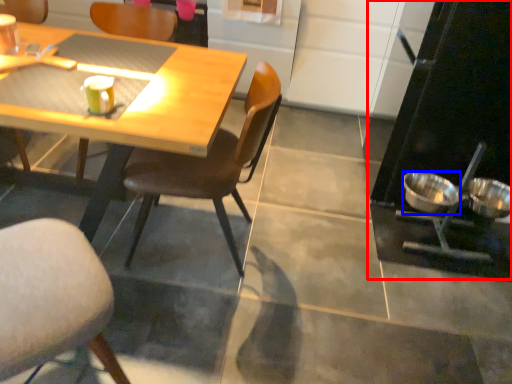
Question: Among these objects, which one is nearest to the camera, appliance (highlighted by a red box) or bowl (highlighted by a blue box)?

Choices:
 (A) appliance
 (B) bowl

Answer: (A)